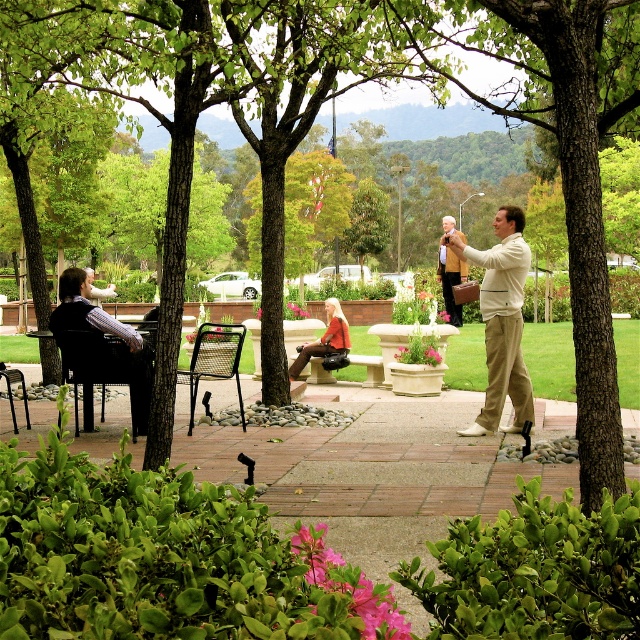
You are a delivery robot with a 1.5 meter long package. You need to place the package between the matte beige jacket at center and the leather handbag at center. Is there enough space for the package to fit between them?

The distance between the matte beige jacket at center and the leather handbag at center is 2.87 meters. Since the package is 1.5 meters long, there is sufficient space to place it between them as the available space is larger than the package length.

You are standing at the point labeled point [100,291] and want to walk towards the point labeled point [449,275]. Given that the path between them is clear, will you be moving closer to or farther from the camera as you walk?

Since point [449,275] is further to the camera than point [100,291], walking towards it means you are moving closer to the camera.

You are standing at the entrance of the park and see a tan leather jacket at center and a matte black jacket at left. Which jacket is closer to you?

→ The tan leather jacket at center is closer to you because it is in front of the matte black jacket at left.